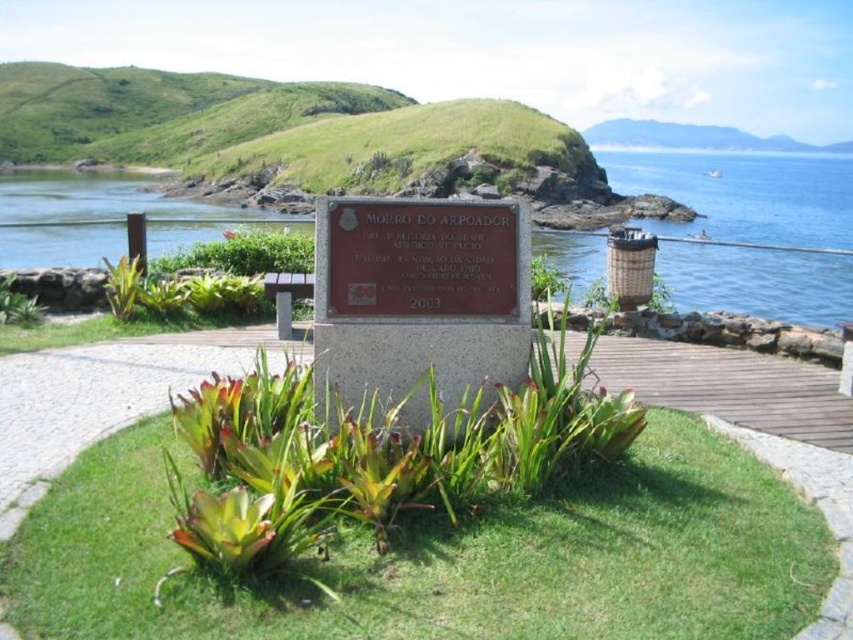
Which is in front, point (454, 465) or point (250, 218)?

Point (454, 465) is in front.

Between green leafy plant at center and blue water at left, which one has less height?

With less height is green leafy plant at center.

Is point (380, 416) closer to camera compared to point (201, 241)?

Yes, point (380, 416) is closer to viewer.

Image resolution: width=853 pixels, height=640 pixels. What are the coordinates of `green leafy plant at center` in the screenshot? It's located at (376, 456).

Does green grass at center have a lesser height compared to green leafy plant at center?

Yes.

Does green grass at center have a smaller size compared to green leafy plant at center?

Actually, green grass at center might be larger than green leafy plant at center.

Which is behind, point (45, 628) or point (517, 388)?

The point (517, 388) is more distant.

The height and width of the screenshot is (640, 853). Identify the location of green grass at center. (447, 557).

Can you confirm if green grass at center is wider than blue water at left?

In fact, green grass at center might be narrower than blue water at left.

Consider the image. Between green grass at center and blue water at left, which one has less height?

Standing shorter between the two is green grass at center.

Which is behind, point (643, 531) or point (30, 244)?

Point (30, 244)

I want to click on green grass at center, so click(x=447, y=557).